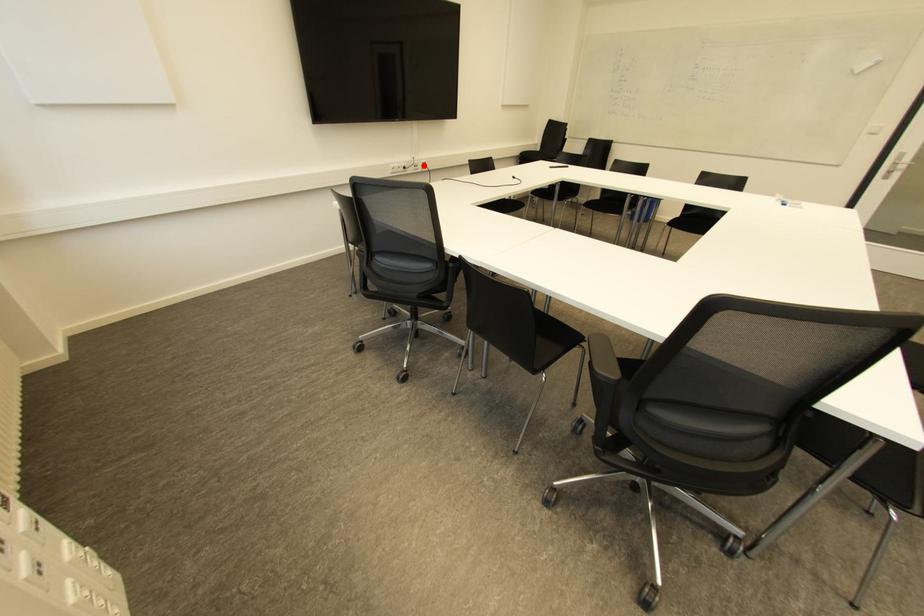
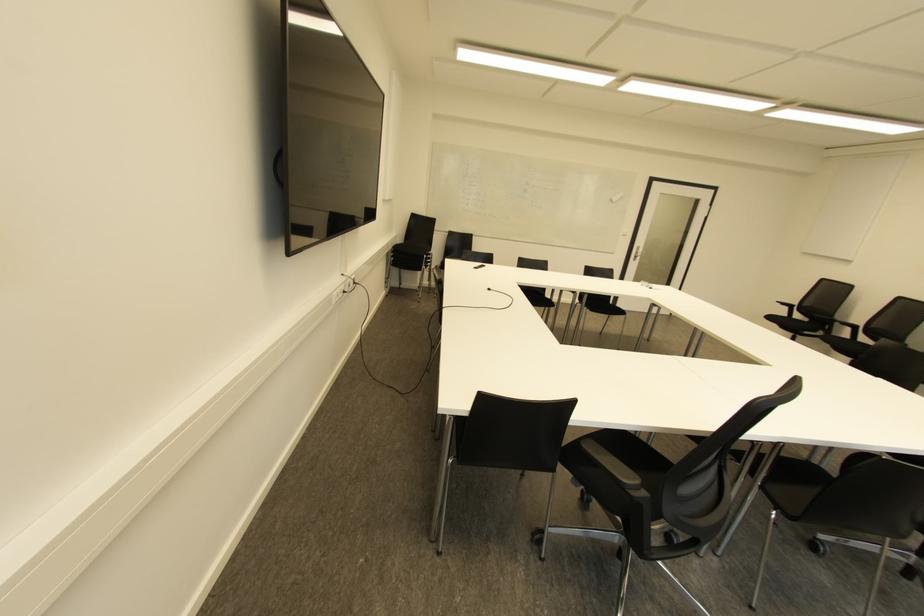
Question: I am providing you with two images of the same scene from different viewpoints. Image1 has a red point marked. In image2, the corresponding 3D location appears at what relative position? Reply with the corresponding letter.

Choices:
 (A) Closer
 (B) Farther

Answer: (A)